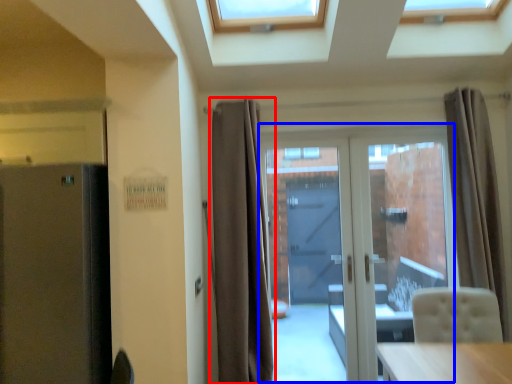
Question: Which of the following is the farthest to the observer, curtain (highlighted by a red box) or door (highlighted by a blue box)?

Choices:
 (A) curtain
 (B) door

Answer: (B)